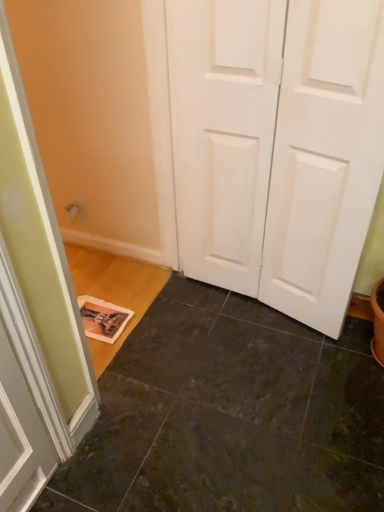
Find the location of a particular element. The width and height of the screenshot is (384, 512). white matte door at center is located at coordinates [277, 146].

Measure the distance between white matte door at center and camera.

white matte door at center is 1.08 meters from camera.

The width and height of the screenshot is (384, 512). What do you see at coordinates (277, 146) in the screenshot?
I see `white matte door at center` at bounding box center [277, 146].

Measure the distance between point (280, 315) and camera.

They are 1.87 meters apart.

The height and width of the screenshot is (512, 384). Find the location of `dark slate tile at lower center`. dark slate tile at lower center is located at coordinates (230, 415).

The image size is (384, 512). Describe the element at coordinates (230, 415) in the screenshot. I see `dark slate tile at lower center` at that location.

You are a GUI agent. You are given a task and a screenshot of the screen. Output one action in this format:
    pyautogui.click(x=<x>, y=<y>)
    Task: Click on the white matte door at center
    Image resolution: width=384 pixels, height=512 pixels.
    Given the screenshot: What is the action you would take?
    point(277,146)

Between white matte door at center and dark slate tile at lower center, which one appears on the left side from the viewer's perspective?

dark slate tile at lower center is more to the left.

Which object is further away from the camera, white matte door at center or dark slate tile at lower center?

Positioned behind is white matte door at center.

Which is nearer, (266,253) or (146,412)?

Point (266,253).

From the image's perspective, would you say white matte door at center is shown under dark slate tile at lower center?

No.

From a real-world perspective, is white matte door at center beneath dark slate tile at lower center?

No, from a real-world perspective, white matte door at center is not under dark slate tile at lower center.

In terms of width, does white matte door at center look wider or thinner when compared to dark slate tile at lower center?

Considering their sizes, white matte door at center looks slimmer than dark slate tile at lower center.

Who is shorter, white matte door at center or dark slate tile at lower center?

With less height is dark slate tile at lower center.

Does white matte door at center have a larger size compared to dark slate tile at lower center?

Indeed, white matte door at center has a larger size compared to dark slate tile at lower center.

Is white matte door at center inside or outside of dark slate tile at lower center?

The correct answer is: outside.

Are white matte door at center and dark slate tile at lower center beside each other?

No, white matte door at center is not in contact with dark slate tile at lower center.

Is white matte door at center oriented towards dark slate tile at lower center?

Yes.

How distant is white matte door at center from dark slate tile at lower center?

white matte door at center is 24.01 inches away from dark slate tile at lower center.

I want to click on tile below the white matte door at center (from a real-world perspective), so click(230, 415).

Considering the relative positions of dark slate tile at lower center and white matte door at center in the image provided, is dark slate tile at lower center to the left of white matte door at center from the viewer's perspective?

Correct, you'll find dark slate tile at lower center to the left of white matte door at center.

Relative to white matte door at center, is dark slate tile at lower center in front or behind?

Visually, dark slate tile at lower center is located in front of white matte door at center.

Is point (87, 490) in front of point (322, 328)?

Yes, it is.

From the image's perspective, is dark slate tile at lower center above white matte door at center?

Incorrect, from the image's perspective, dark slate tile at lower center is lower than white matte door at center.

From a real-world perspective, is dark slate tile at lower center positioned above or below white matte door at center?

From a real-world perspective, dark slate tile at lower center is physically below white matte door at center.

Considering the relative sizes of dark slate tile at lower center and white matte door at center in the image provided, is dark slate tile at lower center thinner than white matte door at center?

Incorrect, the width of dark slate tile at lower center is not less than that of white matte door at center.

In terms of height, does dark slate tile at lower center look taller or shorter compared to white matte door at center?

In the image, dark slate tile at lower center appears to be shorter than white matte door at center.

Does dark slate tile at lower center have a larger size compared to white matte door at center?

Incorrect, dark slate tile at lower center is not larger than white matte door at center.

Is dark slate tile at lower center spatially inside white matte door at center, or outside of it?

dark slate tile at lower center is outside white matte door at center.

Is there a large distance between dark slate tile at lower center and white matte door at center?

dark slate tile at lower center is actually quite close to white matte door at center.

Is white matte door at center at the back of dark slate tile at lower center?

No, white matte door at center is not at the back of dark slate tile at lower center.

This screenshot has height=512, width=384. Find the location of `door on the right of dark slate tile at lower center`. door on the right of dark slate tile at lower center is located at coordinates (277, 146).

Where is `tile that is below the white matte door at center (from the image's perspective)`? tile that is below the white matte door at center (from the image's perspective) is located at coordinates (230, 415).

Find the location of a particular element. door behind the dark slate tile at lower center is located at coordinates (277, 146).